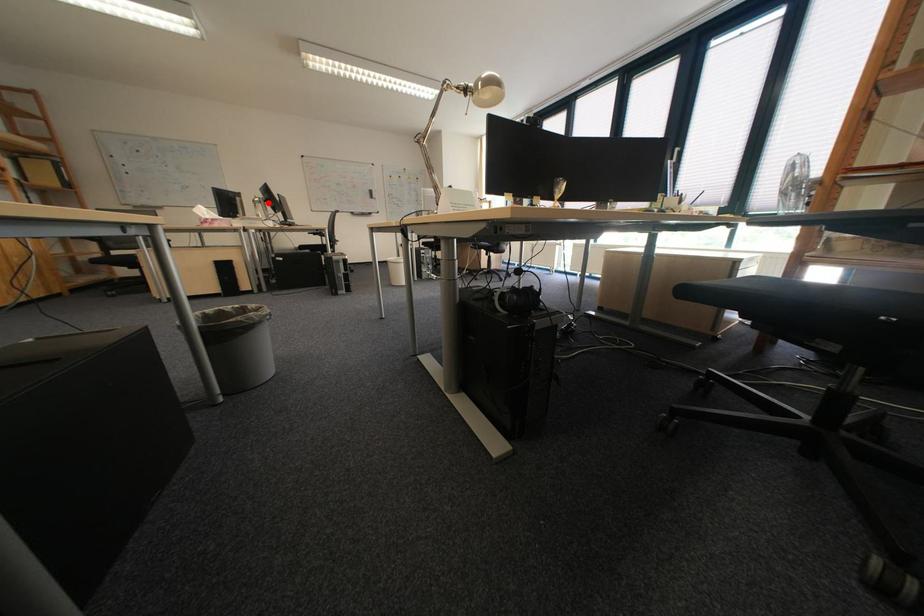
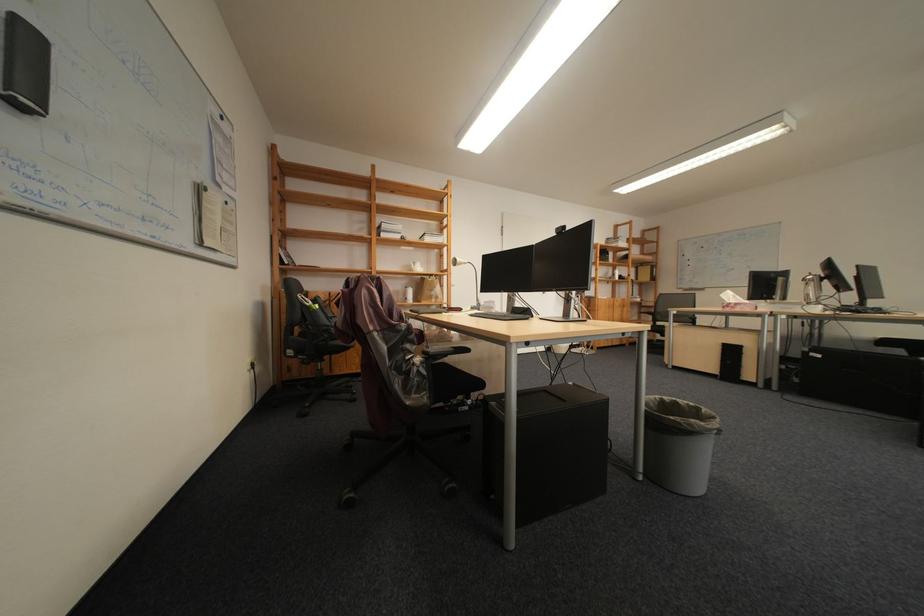
Question: I am providing you with two images of the same scene from different viewpoints. Image1 has a red point marked. In image2, the corresponding 3D location appears at what relative position? Reply with the corresponding letter.

Choices:
 (A) Closer
 (B) Farther

Answer: (B)